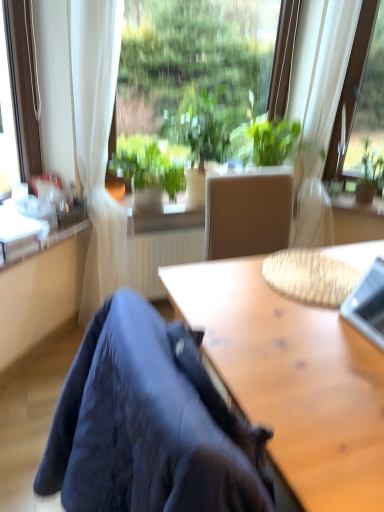
Question: Are silver metallic laptop at upper right and green leafy plant at upper right, marked as the first houseplant in a right-to-left arrangement, making contact?

Choices:
 (A) yes
 (B) no

Answer: (B)

Question: Is silver metallic laptop at upper right facing towards green leafy plant at upper right, placed as the 3th houseplant when sorted from left to right?

Choices:
 (A) no
 (B) yes

Answer: (A)

Question: Does silver metallic laptop at upper right appear on the right side of green leafy plant at upper right, placed as the 3th houseplant when sorted from left to right?

Choices:
 (A) yes
 (B) no

Answer: (B)

Question: Is silver metallic laptop at upper right thinner than green leafy plant at upper right, placed as the 3th houseplant when sorted from left to right?

Choices:
 (A) yes
 (B) no

Answer: (A)

Question: Is the position of silver metallic laptop at upper right more distant than that of green leafy plant at upper right, marked as the first houseplant in a right-to-left arrangement?

Choices:
 (A) yes
 (B) no

Answer: (B)

Question: From the image's perspective, is green leafy plant at center, which is the second houseplant in left-to-right order, located above or below transparent glass window at upper center, placed as the second window when sorted from right to left?

Choices:
 (A) below
 (B) above

Answer: (A)

Question: In the image, is green leafy plant at center, which is the second houseplant in left-to-right order, positioned in front of or behind transparent glass window at upper center, placed as the second window when sorted from right to left?

Choices:
 (A) front
 (B) behind

Answer: (B)

Question: Considering the positions of green leafy plant at center, which appears as the 2th houseplant when viewed from the right, and transparent glass window at upper center, the 1th window in the left-to-right sequence, in the image, is green leafy plant at center, which appears as the 2th houseplant when viewed from the right, wider or thinner than transparent glass window at upper center, the 1th window in the left-to-right sequence,?

Choices:
 (A) thin
 (B) wide

Answer: (B)

Question: Is point (205, 170) closer or farther from the camera than point (256, 15)?

Choices:
 (A) farther
 (B) closer

Answer: (B)

Question: Is green leafy plant at center, marked as the 3th houseplant in a right-to-left arrangement, inside or outside of green leafy plant at center, which is the second houseplant in left-to-right order?

Choices:
 (A) outside
 (B) inside

Answer: (A)

Question: Looking at the image, does green leafy plant at center, positioned as the 1th houseplant in left-to-right order, seem bigger or smaller compared to green leafy plant at center, which is the second houseplant in left-to-right order?

Choices:
 (A) small
 (B) big

Answer: (A)

Question: From their relative heights in the image, would you say green leafy plant at center, marked as the 3th houseplant in a right-to-left arrangement, is taller or shorter than green leafy plant at center, which appears as the 2th houseplant when viewed from the right?

Choices:
 (A) short
 (B) tall

Answer: (A)

Question: In terms of width, does green leafy plant at center, positioned as the 1th houseplant in left-to-right order, look wider or thinner when compared to green leafy plant at center, which appears as the 2th houseplant when viewed from the right?

Choices:
 (A) wide
 (B) thin

Answer: (B)

Question: Is transparent glass window at upper center, the 1th window in the left-to-right sequence, wider or thinner than white sheer curtain at upper center?

Choices:
 (A) wide
 (B) thin

Answer: (B)

Question: Is transparent glass window at upper center, the 1th window in the left-to-right sequence, taller or shorter than white sheer curtain at upper center?

Choices:
 (A) short
 (B) tall

Answer: (A)